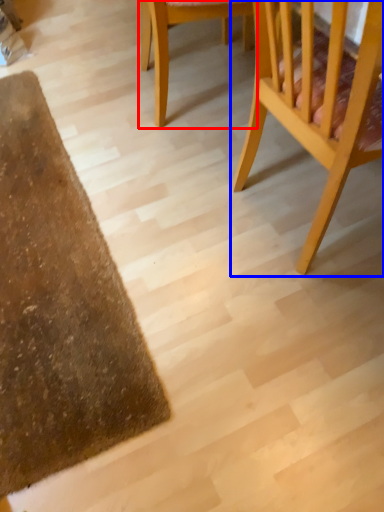
Question: Which object is further to the camera taking this photo, chair (highlighted by a red box) or chair (highlighted by a blue box)?

Choices:
 (A) chair
 (B) chair

Answer: (A)